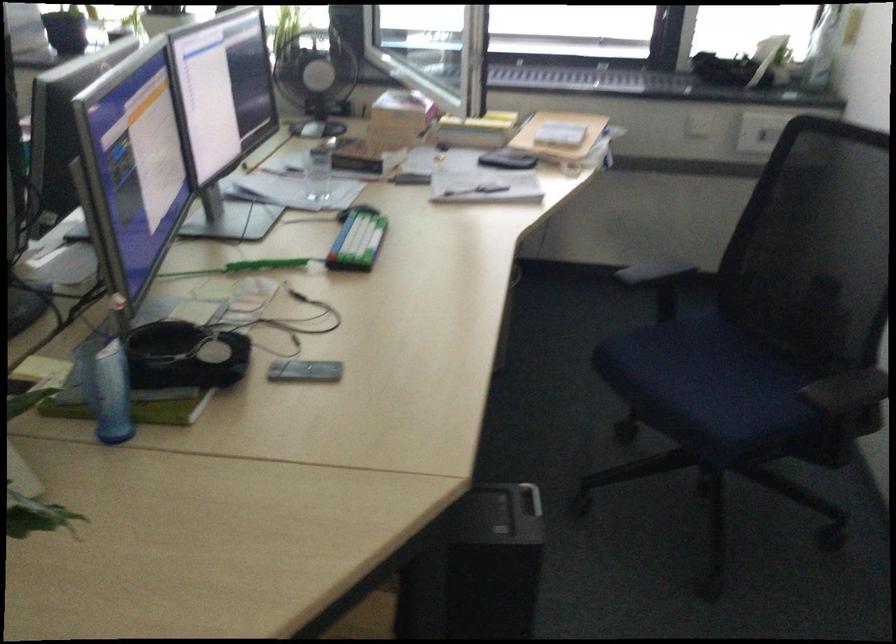
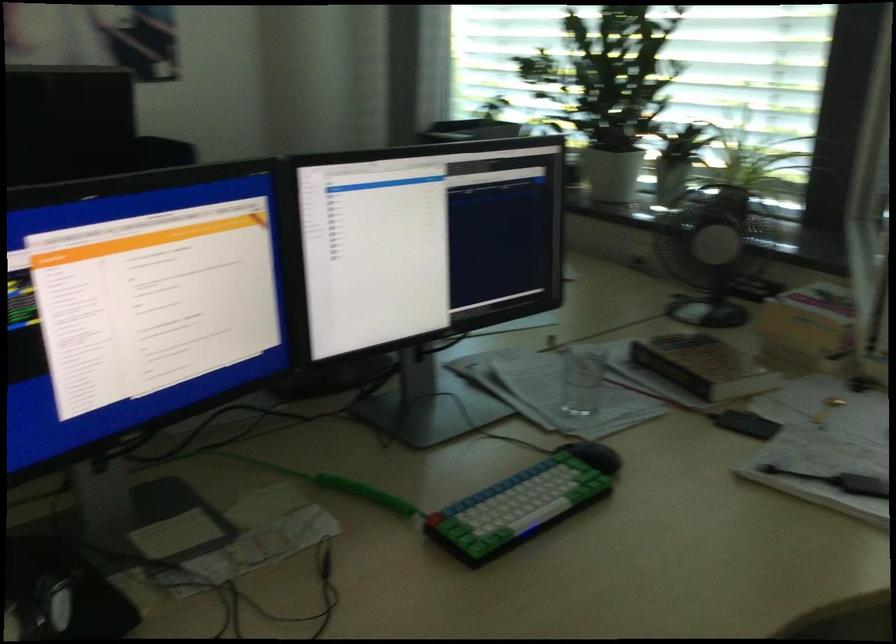
Where in the second image is the point corresponding to [367,238] from the first image?

(523, 503)